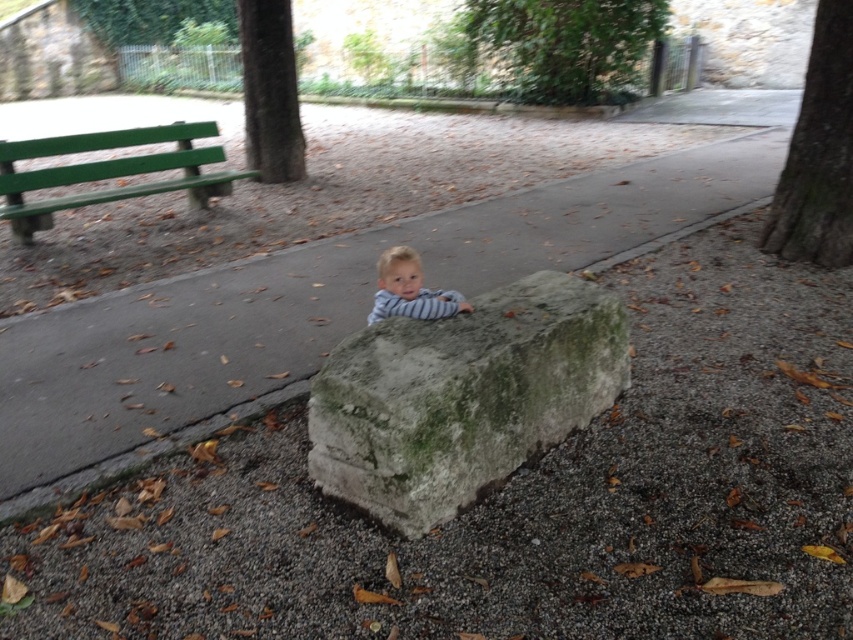
You are standing at the point marked as point (270, 92) in the image. What object is located at this point?

The point (270, 92) corresponds to the green rough bark tree at upper center.

You are a park visitor who wants to sit on the green painted wood bench at left. To get there from the current position, should you walk towards the left or right of the green leafy tree at upper center?

Since the green leafy tree at upper center is to the right of the green painted wood bench at left, you should walk to the left of the green leafy tree at upper center to reach the bench.

You are a photographer setting up a shot of the green rough bark tree at upper center and the striped fabric toddler at center. Which object should you focus on first if you want to capture both in a single frame without moving the camera?

You should focus on the green rough bark tree at upper center first because it is larger and more prominent in the scene compared to the striped fabric toddler at center.